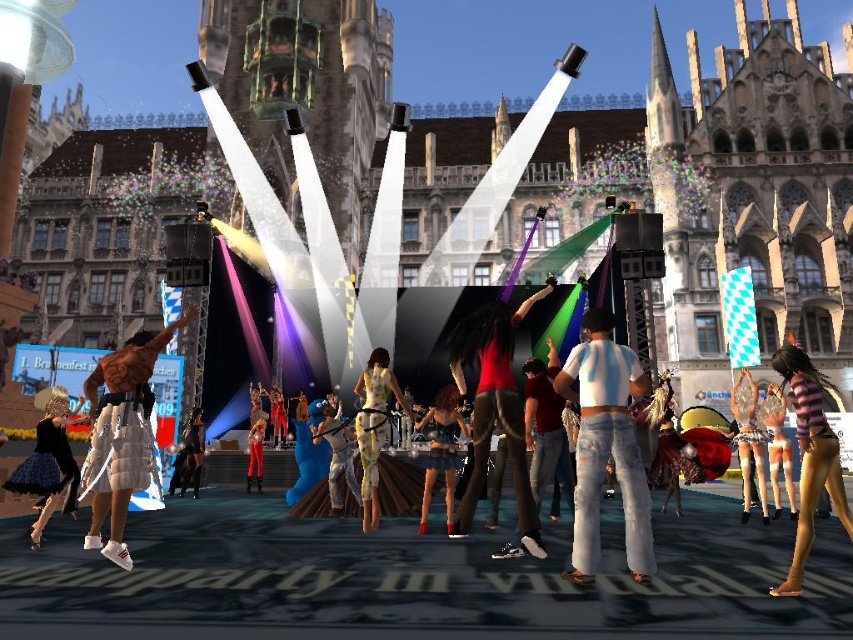
Which is above, floral fabric dress at center or striped fabric dress at lower right?

striped fabric dress at lower right

Who is positioned more to the right, floral fabric dress at center or striped fabric dress at lower right?

striped fabric dress at lower right is more to the right.

Where is `floral fabric dress at center`? This screenshot has width=853, height=640. floral fabric dress at center is located at coordinates (373, 428).

Who is positioned more to the right, matte red shirt at center or shiny black dress at center?

From the viewer's perspective, matte red shirt at center appears more on the right side.

Is matte red shirt at center taller than shiny black dress at center?

Yes, matte red shirt at center is taller than shiny black dress at center.

Is point (517, 314) closer to camera compared to point (442, 401)?

No, it is not.

Find the location of a particular element. The width and height of the screenshot is (853, 640). matte red shirt at center is located at coordinates tap(495, 412).

Who is taller, floral fabric dress at center or denim pants at center?

floral fabric dress at center

You are a GUI agent. You are given a task and a screenshot of the screen. Output one action in this format:
    pyautogui.click(x=<x>, y=<y>)
    Task: Click on the floral fabric dress at center
    This screenshot has height=640, width=853.
    Given the screenshot: What is the action you would take?
    pyautogui.click(x=373, y=428)

Who is more forward, (376, 476) or (358, 490)?

Positioned in front is point (376, 476).

Find the location of a particular element. The width and height of the screenshot is (853, 640). floral fabric dress at center is located at coordinates (373, 428).